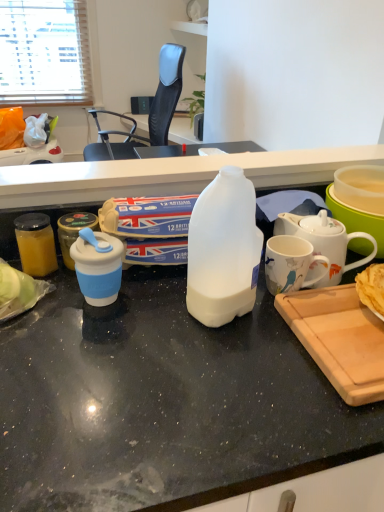
Question: Considering the positions of point (158, 56) and point (18, 217), is point (158, 56) closer or farther from the camera than point (18, 217)?

Choices:
 (A) closer
 (B) farther

Answer: (B)

Question: Would you say black mesh chair at upper center is inside or outside translucent glass jar at left, the first kitchen appliance from the left?

Choices:
 (A) outside
 (B) inside

Answer: (A)

Question: Estimate the real-world distances between objects in this image. Which object is farther from the wooden cutting board at lower right?

Choices:
 (A) white ceramic mug at center right, the first coffee cup viewed from the right
 (B) blue silicone cup at left, arranged as the second kitchen appliance when viewed from the left
 (C) white matte plastic bottle at center
 (D) translucent glass jar at left, the first kitchen appliance from the left
 (E) blue matte coffee cup at left, the 2th coffee cup from the right

Answer: (D)

Question: Which of these objects is positioned farthest from the white ceramic mug at center right, acting as the second coffee cup starting from the left?

Choices:
 (A) translucent plastic bowl at right
 (B) translucent glass jar at left, the second kitchen appliance in the right-to-left sequence
 (C) black mesh chair at upper center
 (D) blue silicone cup at left, arranged as the second kitchen appliance when viewed from the left
 (E) translucent plastic milk bottle at center

Answer: (C)